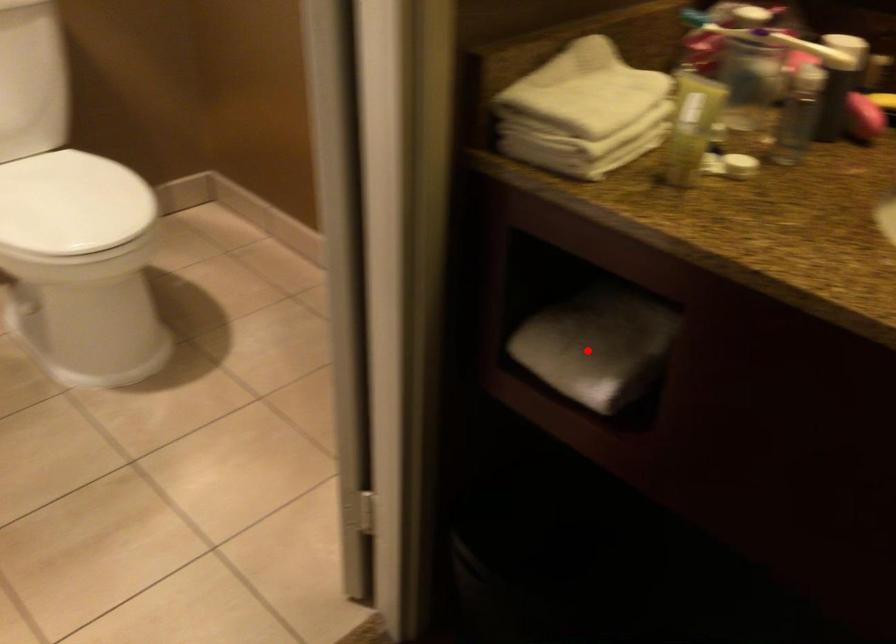
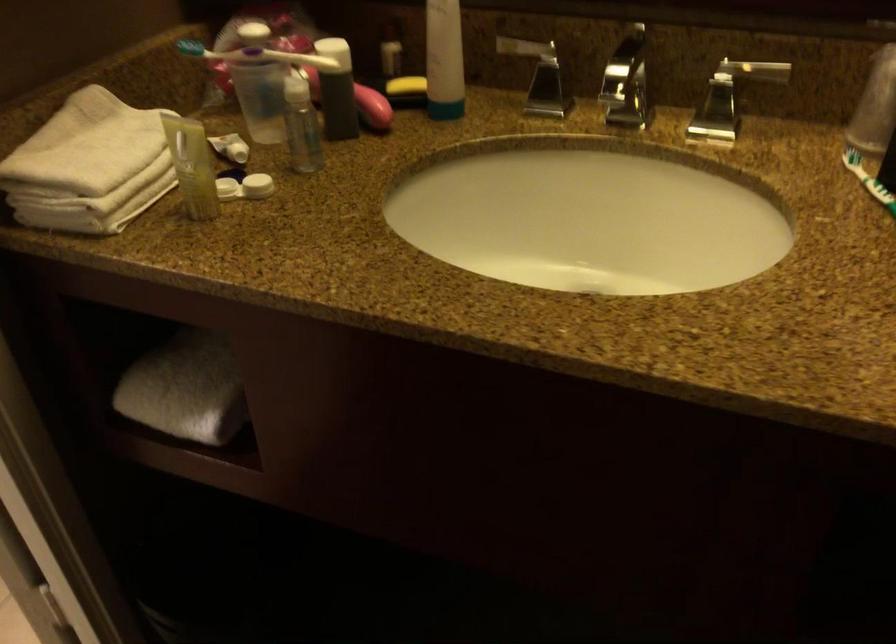
Question: I am providing you with two images of the same scene from different viewpoints. A red point is marked on the first image. Can you still see the location of the red point in image 2?

Choices:
 (A) Yes
 (B) No

Answer: (A)